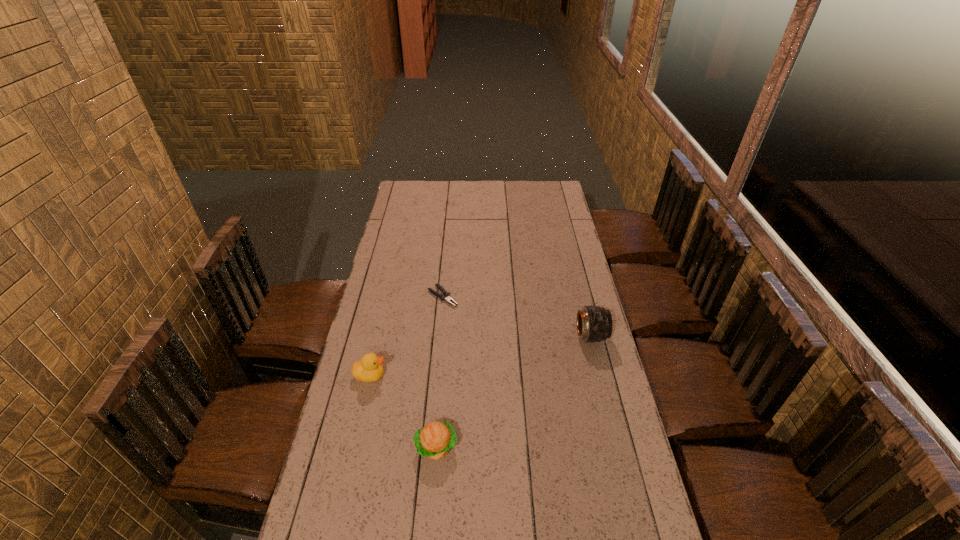
I want to click on object that ranks as the closest to the rightmost object, so click(447, 297).

This screenshot has height=540, width=960. Find the location of `vacant space that satisfies the following two spatial constraints: 1. on the back side of the third nearest object; 2. at the front element of the nearest object`. vacant space that satisfies the following two spatial constraints: 1. on the back side of the third nearest object; 2. at the front element of the nearest object is located at coordinates pos(445,336).

Identify the location of vacant area that satisfies the following two spatial constraints: 1. on the front side of the hamburger; 2. on the right side of the pliers. (429, 447).

The height and width of the screenshot is (540, 960). In order to click on vacant space that satisfies the following two spatial constraints: 1. on the back side of the leftmost object; 2. on the left side of the farthest object in this screenshot , I will do `click(388, 296)`.

The height and width of the screenshot is (540, 960). In order to click on vacant point that satisfies the following two spatial constraints: 1. on the front side of the hamburger; 2. on the left side of the farthest object in this screenshot , I will do `click(429, 447)`.

Where is `vacant position in the image that satisfies the following two spatial constraints: 1. on the front side of the rightmost object; 2. at the front element of the farthest object`? This screenshot has width=960, height=540. vacant position in the image that satisfies the following two spatial constraints: 1. on the front side of the rightmost object; 2. at the front element of the farthest object is located at coordinates pyautogui.click(x=439, y=336).